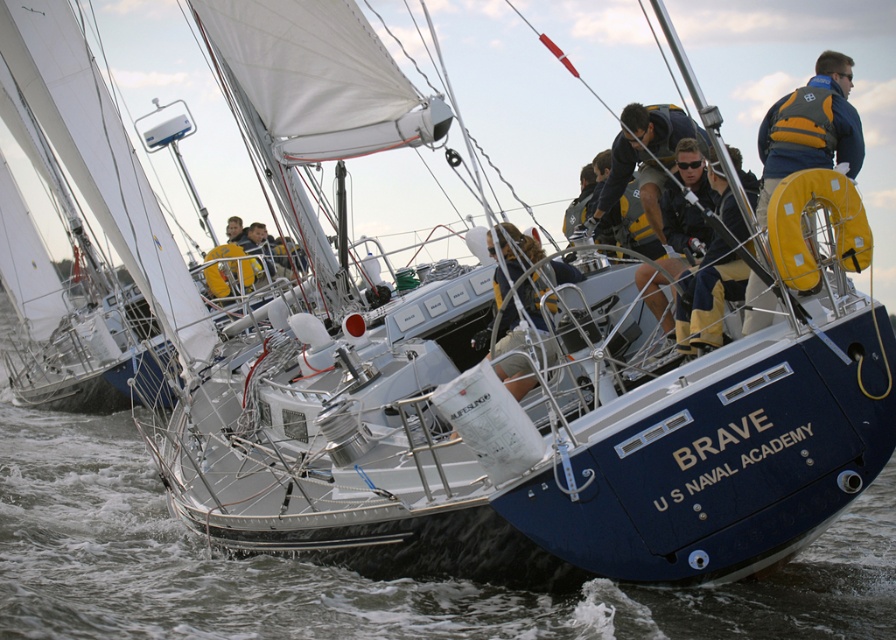
Question: Is clear water at lower center bigger than yellow life vest at center?

Choices:
 (A) no
 (B) yes

Answer: (B)

Question: Can you confirm if yellow life vest at center is positioned to the right of yellow fabric life jacket at upper right?

Choices:
 (A) no
 (B) yes

Answer: (A)

Question: Which point is farther to the camera?

Choices:
 (A) yellow life vest at center
 (B) yellow fabric life jacket at upper right

Answer: (B)

Question: Which point is farther to the camera?

Choices:
 (A) (780, 128)
 (B) (503, 230)
 (C) (636, 612)

Answer: (A)

Question: Which object appears closest to the camera in this image?

Choices:
 (A) yellow life jacket at center
 (B) yellow fabric life jacket at upper right
 (C) clear water at lower center
 (D) yellow life vest at center

Answer: (C)

Question: Does yellow life vest at center have a greater width compared to yellow life jacket at center?

Choices:
 (A) yes
 (B) no

Answer: (A)